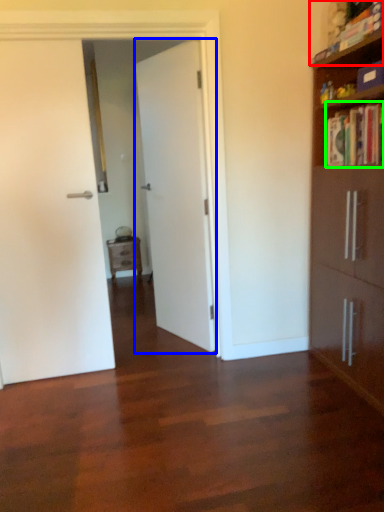
Question: Which object is the closest to the book (highlighted by a red box)? Choose among these: door (highlighted by a blue box) or book (highlighted by a green box).

Choices:
 (A) door
 (B) book

Answer: (B)